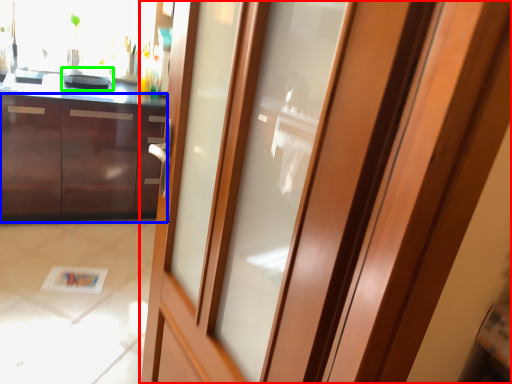
Question: Considering the real-world distances, which object is farthest from door (highlighted by a red box)? cabinetry (highlighted by a blue box) or appliance (highlighted by a green box)?

Choices:
 (A) cabinetry
 (B) appliance

Answer: (B)